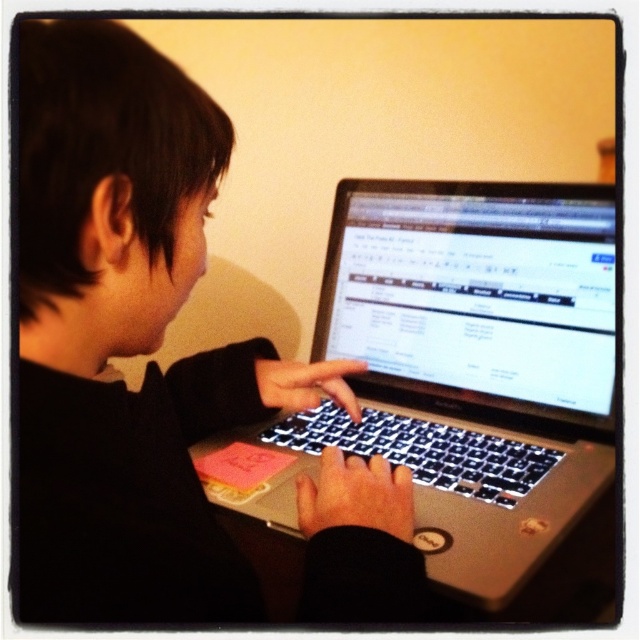
You are organizing a tech fair and need to arrange two laptops on a table. The laptops are the matte black laptop at center and the silver metallic laptop at center. According to the image, which laptop should be placed to the left to match the original setup?

The matte black laptop at center should be placed to the left of the silver metallic laptop at center to match the original setup.

You are organizing a desk and want to place a new keyboard between the matte black laptop at center and the silver metallic laptop at center. Based on their positions, which laptop should the keyboard be placed closer to?

The keyboard should be placed closer to the matte black laptop at center because it is in front of the silver metallic laptop at center, so the keyboard would naturally be positioned near the front laptop.

You are a photographer setting up a shot of the scene described. You need to ensure that the matte black laptop at center is in focus. Given that your camera has a depth of field that can sharply capture objects within 10 inches of the focal point, should you adjust your focus to be closer to the laptop?

The matte black laptop at center is 11.51 inches from the camera, which is beyond the 10 inch depth of field range. Therefore, you should adjust your focus to be closer to the laptop to ensure it is in sharp focus.